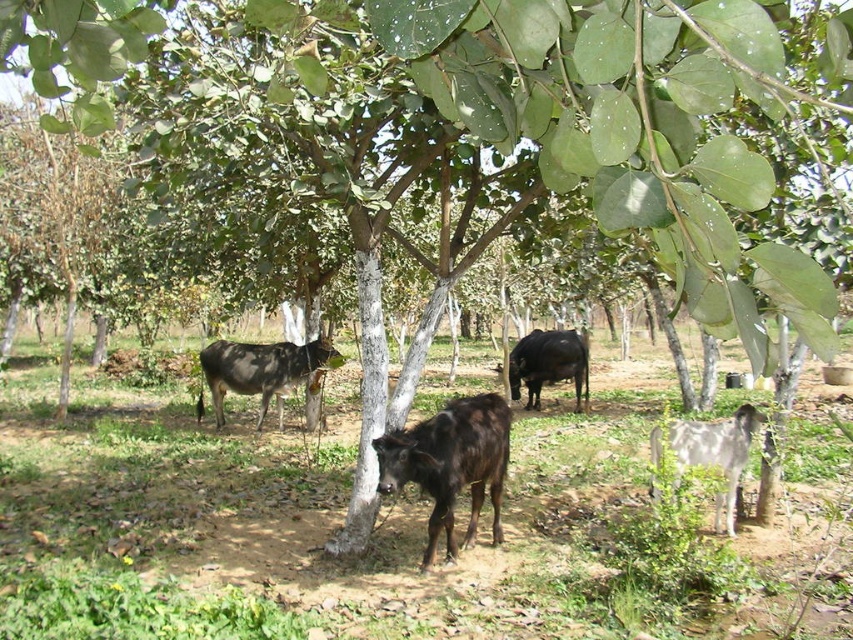
You are a farmer standing at the edge of the field. You see the dark brown glossy cow at center. Can you estimate its position in the image using coordinates?

The dark brown glossy cow at center is located at coordinates approximately at point 0.580 in the x axis and 0.307 in the y axis.